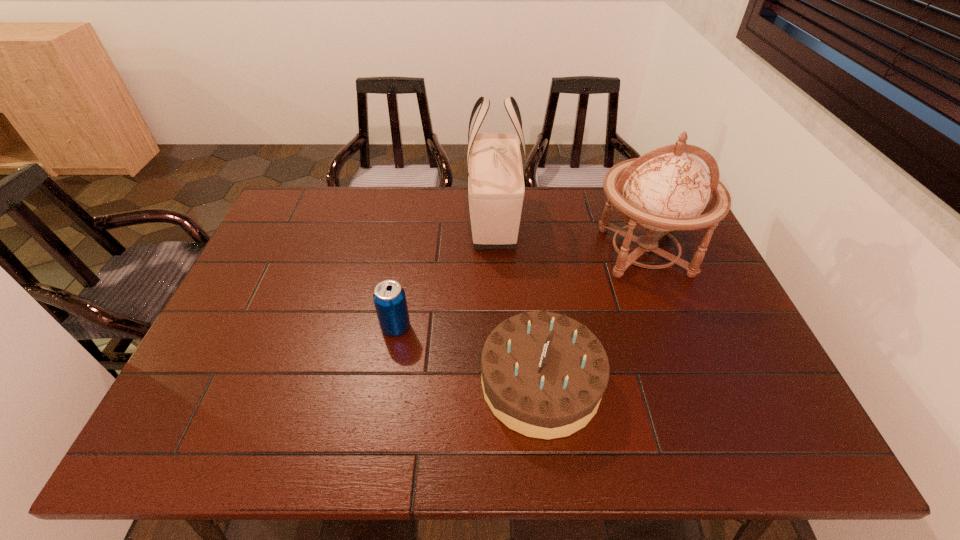
You are a GUI agent. You are given a task and a screenshot of the screen. Output one action in this format:
    pyautogui.click(x=<x>, y=<y>)
    Task: Click on the free spot between the shopping bag and the birthday cake
    This screenshot has height=540, width=960.
    Given the screenshot: What is the action you would take?
    pyautogui.click(x=517, y=302)

Image resolution: width=960 pixels, height=540 pixels. Find the location of `vacant space in between the pop soda and the shopping bag`. vacant space in between the pop soda and the shopping bag is located at coordinates (444, 274).

At what (x,y) coordinates should I click in order to perform the action: click on free space that is in between the pop soda and the globe. Please return your answer as a coordinate pair (x, y). The image size is (960, 540). Looking at the image, I should click on (520, 290).

What are the coordinates of `vacant space that's between the leftmost object and the shopping bag` in the screenshot? It's located at pyautogui.click(x=444, y=274).

Locate an element on the screen. The width and height of the screenshot is (960, 540). free space between the rightmost object and the shopping bag is located at coordinates (569, 237).

This screenshot has width=960, height=540. Identify the location of unoccupied area between the birthday cake and the shopping bag. coord(517,302).

Find the location of a particular element. This screenshot has height=540, width=960. free space between the globe and the shopping bag is located at coordinates click(569, 237).

I want to click on vacant area between the shopping bag and the globe, so click(569, 237).

Identify the location of free space between the rightmost object and the leftmost object. The height and width of the screenshot is (540, 960). tap(520, 290).

Find the location of `free space between the birthday cake and the shopping bag`. free space between the birthday cake and the shopping bag is located at coordinates (517, 302).